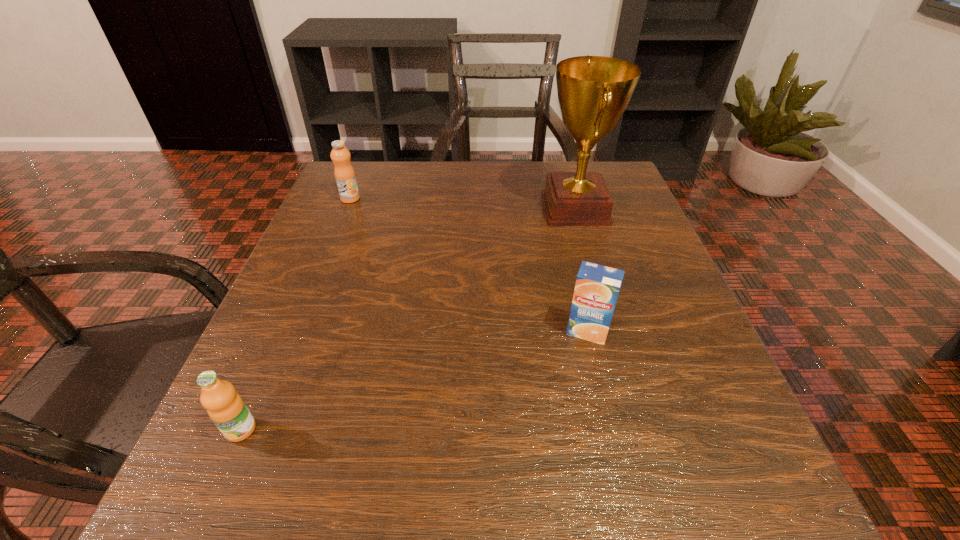
Locate an element on the screen. The width and height of the screenshot is (960, 540). vacant space located on the label of the nearest orange juice is located at coordinates (203, 518).

You are a GUI agent. You are given a task and a screenshot of the screen. Output one action in this format:
    pyautogui.click(x=<x>, y=<y>)
    Task: Click on the award present at the far edge
    This screenshot has width=960, height=540.
    Given the screenshot: What is the action you would take?
    pyautogui.click(x=593, y=92)

The height and width of the screenshot is (540, 960). Identify the location of orange juice that is at the far edge. [x=344, y=173].

Find the location of a particular element. award that is at the right edge is located at coordinates (593, 92).

Where is `orange_juice present at the right edge`? orange_juice present at the right edge is located at coordinates (597, 286).

Locate an element on the screen. object situated at the far left corner is located at coordinates (344, 173).

Image resolution: width=960 pixels, height=540 pixels. I want to click on object that is at the far right corner, so click(x=593, y=92).

Where is `vacant space at the far edge of the desktop`? vacant space at the far edge of the desktop is located at coordinates (427, 201).

Image resolution: width=960 pixels, height=540 pixels. Find the location of `free space at the near edge`. free space at the near edge is located at coordinates (505, 524).

In the image, there is a desktop. Where is `vacant space at the left edge`? vacant space at the left edge is located at coordinates (343, 303).